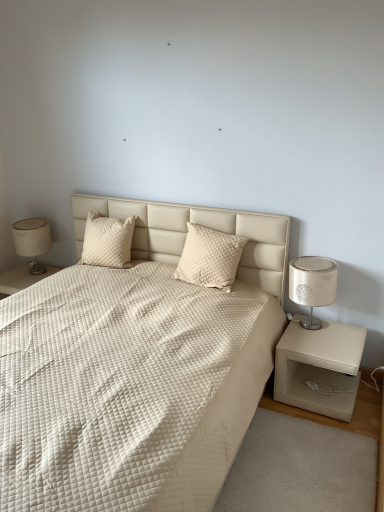
Question: Can you confirm if white quilted fabric bed at center is bigger than cream quilted pillow at center, which is counted as the 2th pillow, starting from the left?

Choices:
 (A) no
 (B) yes

Answer: (B)

Question: Are white quilted fabric bed at center and cream quilted pillow at center, placed as the 1th pillow when sorted from right to left, located far from each other?

Choices:
 (A) no
 (B) yes

Answer: (A)

Question: Is white quilted fabric bed at center behind cream quilted pillow at center, which is counted as the 2th pillow, starting from the left?

Choices:
 (A) yes
 (B) no

Answer: (B)

Question: Is cream quilted pillow at center, placed as the 1th pillow when sorted from right to left, surrounded by white quilted fabric bed at center?

Choices:
 (A) no
 (B) yes

Answer: (B)

Question: Is white quilted fabric bed at center not within cream quilted pillow at center, which is counted as the 2th pillow, starting from the left?

Choices:
 (A) yes
 (B) no

Answer: (A)

Question: From the image's perspective, is beige leather nightstand at right, the 2th nightstand positioned from the left, above or below white leather nightstand at lower left, arranged as the second nightstand when ordered from the bottom?

Choices:
 (A) above
 (B) below

Answer: (B)

Question: Looking at the image, does beige leather nightstand at right, the 2th nightstand from the top, seem bigger or smaller compared to white leather nightstand at lower left, the first nightstand when ordered from back to front?

Choices:
 (A) big
 (B) small

Answer: (A)

Question: Visually, is beige leather nightstand at right, which appears as the second nightstand when viewed from the back, positioned to the left or to the right of white leather nightstand at lower left, arranged as the second nightstand when ordered from the bottom?

Choices:
 (A) left
 (B) right

Answer: (B)

Question: Considering the positions of beige leather nightstand at right, the 2th nightstand positioned from the left, and white leather nightstand at lower left, arranged as the second nightstand when ordered from the bottom, in the image, is beige leather nightstand at right, the 2th nightstand positioned from the left, wider or thinner than white leather nightstand at lower left, arranged as the second nightstand when ordered from the bottom,?

Choices:
 (A) thin
 (B) wide

Answer: (A)

Question: Considering the relative positions of beige leather nightstand at right, the first nightstand in the right-to-left sequence, and matte beige lampshade at left in the image provided, is beige leather nightstand at right, the first nightstand in the right-to-left sequence, to the left or to the right of matte beige lampshade at left?

Choices:
 (A) right
 (B) left

Answer: (A)

Question: Is beige leather nightstand at right, the 2th nightstand positioned from the left, taller or shorter than matte beige lampshade at left?

Choices:
 (A) tall
 (B) short

Answer: (B)

Question: In the image, is beige leather nightstand at right, the first nightstand in the right-to-left sequence, positioned in front of or behind matte beige lampshade at left?

Choices:
 (A) behind
 (B) front

Answer: (B)

Question: In terms of size, does beige leather nightstand at right, the 2th nightstand from the top, appear bigger or smaller than matte beige lampshade at left?

Choices:
 (A) small
 (B) big

Answer: (B)

Question: Is white leather nightstand at lower left, marked as the 2th nightstand in a front-to-back arrangement, spatially inside white quilted fabric bed at center, or outside of it?

Choices:
 (A) outside
 (B) inside

Answer: (A)

Question: In terms of height, does white leather nightstand at lower left, marked as the 2th nightstand in a front-to-back arrangement, look taller or shorter compared to white quilted fabric bed at center?

Choices:
 (A) short
 (B) tall

Answer: (A)